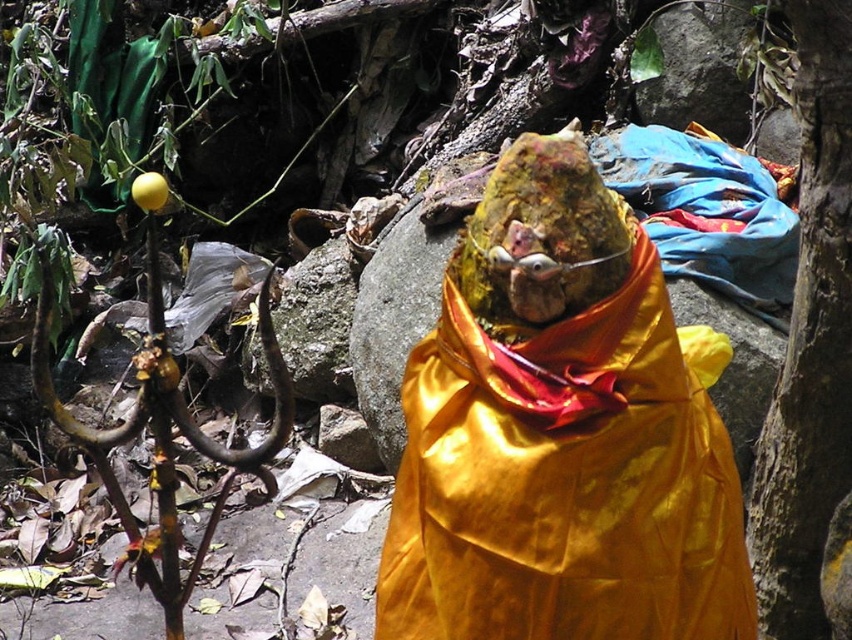
Question: Among these objects, which one is farthest from the camera?

Choices:
 (A) shiny gold statue at center
 (B) smooth brown bark at right

Answer: (B)

Question: Which point is closer to the camera?

Choices:
 (A) smooth brown bark at right
 (B) shiny gold statue at center

Answer: (B)

Question: Can you confirm if shiny gold statue at center is positioned above smooth brown bark at right?

Choices:
 (A) yes
 (B) no

Answer: (B)

Question: Is shiny gold statue at center to the right of smooth brown bark at right from the viewer's perspective?

Choices:
 (A) yes
 (B) no

Answer: (B)

Question: Is shiny gold statue at center smaller than smooth brown bark at right?

Choices:
 (A) no
 (B) yes

Answer: (B)